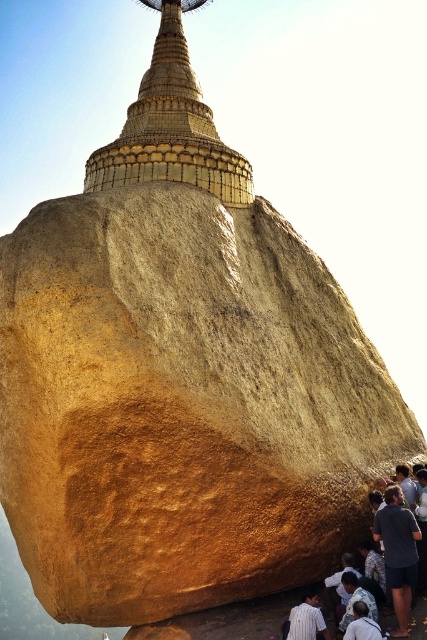
Consider the image. You are standing at the base of the large golden rock formation. You want to visit the gold textured stupa at upper center. Given that the stupa is 207.62 feet away from you, can you estimate how long it would take to walk there at a normal pace?

The gold textured stupa at upper center is 207.62 feet away. At a normal walking pace of about 3 feet per second, it would take approximately 69 seconds, or just over a minute, to reach the stupa.

Consider the image. You are standing 50 meters away from the golden rock formation. If you move forward 3.5 meters, will you be closer to the point at coordinates point (324, 621)?

The distance of point (324, 621) from viewer is 46.31 meters. Moving forward 3.5 meters from your current position 50 meters away would bring you to 46.5 meters away, which is slightly closer than the point. Therefore, yes, you will be closer to the point at coordinates point (324, 621).

You are standing at the base of the golden rock formation and looking up. There is a gold textured stupa at upper center located at point (170,129). Which direction should you look to see the gold textured stupa at upper center?

The gold textured stupa at upper center is located at point (170,129), which is in the upper center direction from your position at the base of the rock formation. Therefore, you should look upward and towards the center to see it.